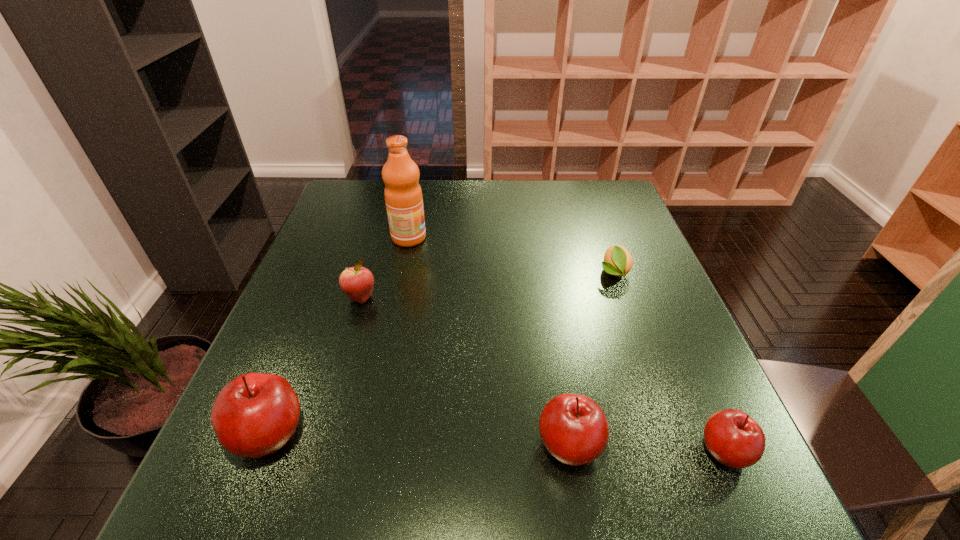
You are a GUI agent. You are given a task and a screenshot of the screen. Output one action in this format:
    pyautogui.click(x=<x>, y=<y>)
    Task: Click on the tallest apple
    This screenshot has height=540, width=960.
    Given the screenshot: What is the action you would take?
    pos(254,415)

At what (x,y) coordinates should I click in order to perform the action: click on the second apple from right to left. Please return your answer as a coordinate pair (x, y). This screenshot has width=960, height=540. Looking at the image, I should click on (574, 429).

Where is `the second shortest object`? Image resolution: width=960 pixels, height=540 pixels. the second shortest object is located at coordinates (733, 438).

Find the location of a particular element. The height and width of the screenshot is (540, 960). the shortest apple is located at coordinates (733, 438).

The image size is (960, 540). What are the coordinates of `the shortest object` in the screenshot? It's located at (618, 261).

Find the location of `fruit juice`. fruit juice is located at coordinates (403, 196).

Where is `the farthest object`? the farthest object is located at coordinates tap(403, 196).

This screenshot has height=540, width=960. I want to click on the farthest apple, so click(x=357, y=282).

This screenshot has height=540, width=960. What are the coordinates of `vacant area situated on the back of the tallest apple` in the screenshot? It's located at (300, 356).

Image resolution: width=960 pixels, height=540 pixels. I want to click on vacant point located 0.330m on the left of the second apple from right to left, so click(349, 445).